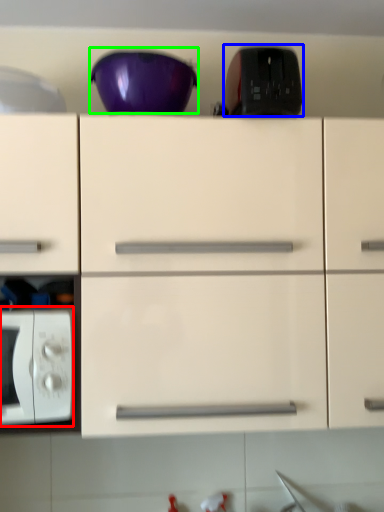
Question: Which object is positioned farthest from microwave oven (highlighted by a red box)? Select from appliance (highlighted by a blue box) and bowl (highlighted by a green box).

Choices:
 (A) appliance
 (B) bowl

Answer: (A)